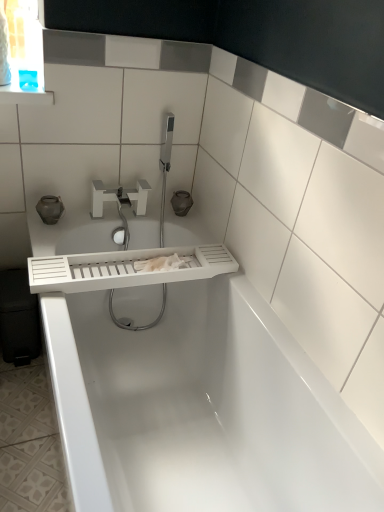
This screenshot has width=384, height=512. What do you see at coordinates (191, 392) in the screenshot? I see `white glossy bathtub at center` at bounding box center [191, 392].

The image size is (384, 512). In order to click on white plastic tap at upper center in this screenshot , I will do `click(119, 197)`.

Does white matte tray at center lie in front of white plastic tap at upper center?

Yes, it is in front of white plastic tap at upper center.

In the scene shown: From a real-world perspective, relative to white plastic tap at upper center, is white matte tray at center vertically above or below?

Clearly, from a real-world perspective, white matte tray at center is below white plastic tap at upper center.

Is white matte tray at center not within white plastic tap at upper center?

white matte tray at center is positioned outside white plastic tap at upper center.

Which of these two, white matte tray at center or white plastic tap at upper center, is thinner?

white plastic tap at upper center.

Measure the distance between white glossy bathtub at center and white plastic tap at upper center.

60.72 centimeters.

Where is `bathtub in front of the white plastic tap at upper center`? bathtub in front of the white plastic tap at upper center is located at coordinates (191, 392).

From the image's perspective, is white glossy bathtub at center below white plastic tap at upper center?

Indeed, from the image's perspective, white glossy bathtub at center is shown beneath white plastic tap at upper center.

Is white glossy bathtub at center placed right next to white plastic tap at upper center?

There is a gap between white glossy bathtub at center and white plastic tap at upper center.

Is white plastic tap at upper center bigger or smaller than white glossy bathtub at center?

white plastic tap at upper center is smaller than white glossy bathtub at center.

Between white plastic tap at upper center and white glossy bathtub at center, which one appears on the right side from the viewer's perspective?

From the viewer's perspective, white glossy bathtub at center appears more on the right side.

In the scene shown: Is white plastic tap at upper center situated inside white glossy bathtub at center or outside?

white plastic tap at upper center is located beyond the bounds of white glossy bathtub at center.

Does white matte tray at center appear on the left side of white glossy bathtub at center?

Indeed, white matte tray at center is positioned on the left side of white glossy bathtub at center.

From the image's perspective, which is below, white matte tray at center or white glossy bathtub at center?

white glossy bathtub at center appears lower in the image.

Does white matte tray at center come in front of white glossy bathtub at center?

No, white matte tray at center is further to the viewer.

Could white glossy bathtub at center be considered to be inside white matte tray at center?

No, white glossy bathtub at center is not inside white matte tray at center.

From the image's perspective, relative to white matte tray at center, is white plastic tap at upper center above or below?

Based on their image positions, white plastic tap at upper center is located above white matte tray at center.

You are a GUI agent. You are given a task and a screenshot of the screen. Output one action in this format:
    pyautogui.click(x=<x>, y=<y>)
    Task: Click on the balustrade that is below the white plastic tap at upper center (from the image's perspective)
    
    Given the screenshot: What is the action you would take?
    pyautogui.click(x=126, y=269)

Can you tell me how much white plastic tap at upper center and white matte tray at center differ in facing direction?

They differ by 0.83 degrees in their facing directions.

Would you say white plastic tap at upper center is a long distance from white matte tray at center?

white plastic tap at upper center is actually quite close to white matte tray at center.

How different are the orientations of white glossy bathtub at center and white matte tray at center in degrees?

white glossy bathtub at center and white matte tray at center are facing 88.1 degrees away from each other.

Can you confirm if white glossy bathtub at center is taller than white matte tray at center?

Indeed, white glossy bathtub at center has a greater height compared to white matte tray at center.

Which object is closer to the camera, white glossy bathtub at center or white matte tray at center?

white glossy bathtub at center is more forward.

Is point (186, 443) more distant than point (138, 285)?

No, it is not.

Locate an element on the screen. This screenshot has width=384, height=512. balustrade below the white plastic tap at upper center (from the image's perspective) is located at coordinates (126, 269).

Find the location of `tap above the white glossy bathtub at center (from the image's perspective)`. tap above the white glossy bathtub at center (from the image's perspective) is located at coordinates (119, 197).

Looking at the image, which one is located further to white plastic tap at upper center, white glossy bathtub at center or white matte tray at center?

white glossy bathtub at center.

Estimate the real-world distances between objects in this image. Which object is further from white glossy bathtub at center, white plastic tap at upper center or white matte tray at center?

white plastic tap at upper center.

From the image, which object appears to be farther from white plastic tap at upper center, white matte tray at center or white glossy bathtub at center?

white glossy bathtub at center.

Which object lies nearer to the anchor point white matte tray at center, white plastic tap at upper center or white glossy bathtub at center?

Based on the image, white glossy bathtub at center appears to be nearer to white matte tray at center.

Estimate the real-world distances between objects in this image. Which object is further from white matte tray at center, white glossy bathtub at center or white plastic tap at upper center?

Among the two, white plastic tap at upper center is located further to white matte tray at center.

Based on their spatial positions, is white matte tray at center or white plastic tap at upper center further from white glossy bathtub at center?

white plastic tap at upper center is further to white glossy bathtub at center.

Locate an element on the screen. This screenshot has height=512, width=384. balustrade between white glossy bathtub at center and white plastic tap at upper center in the front-back direction is located at coordinates (126, 269).